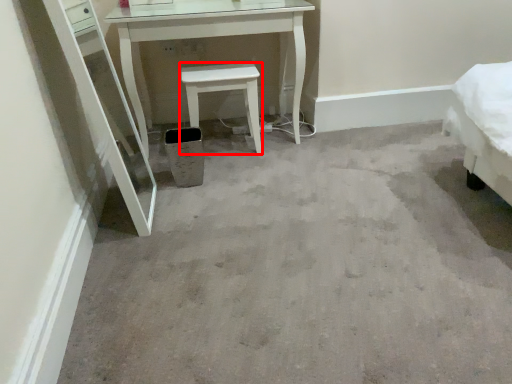
Question: Observing the image, what is the correct spatial positioning of stool (annotated by the red box) in reference to trash bin/can?

Choices:
 (A) right
 (B) left

Answer: (A)